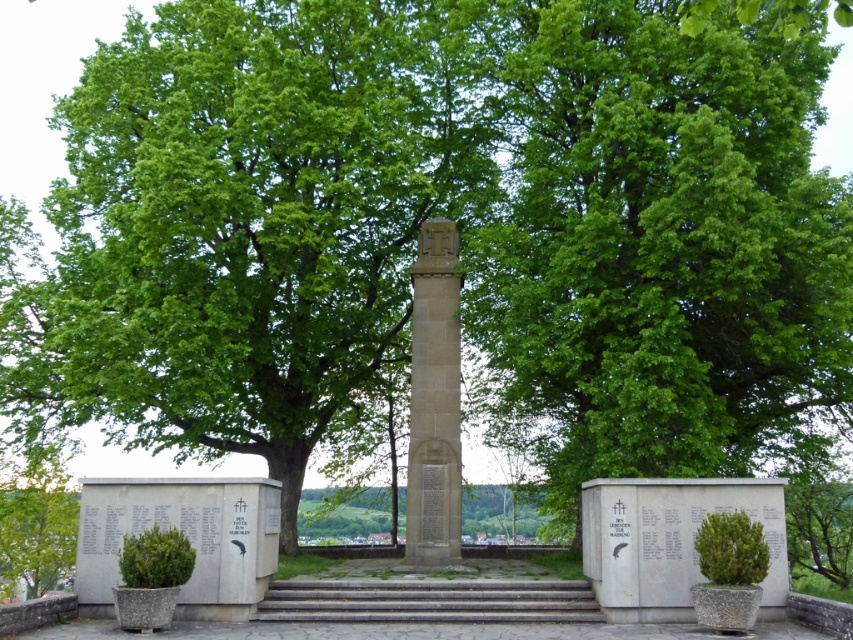
Question: Which point is farther to the camera?

Choices:
 (A) (412, 337)
 (B) (618, 458)

Answer: (A)

Question: Which object is closer to the camera taking this photo?

Choices:
 (A) green leafy tree at center
 (B) concrete stairs at center
 (C) stone obelisk at center
 (D) green leafy tree at lower left

Answer: (B)

Question: Can you confirm if stone obelisk at center is positioned to the right of green leafy tree at lower left?

Choices:
 (A) yes
 (B) no

Answer: (A)

Question: Where is stone obelisk at center located in relation to green leafy tree at lower left in the image?

Choices:
 (A) left
 (B) right

Answer: (B)

Question: Does stone obelisk at center appear on the right side of concrete stairs at center?

Choices:
 (A) yes
 (B) no

Answer: (A)

Question: Which point appears farthest from the camera in this image?

Choices:
 (A) (16, 536)
 (B) (329, 595)
 (C) (700, 164)

Answer: (A)